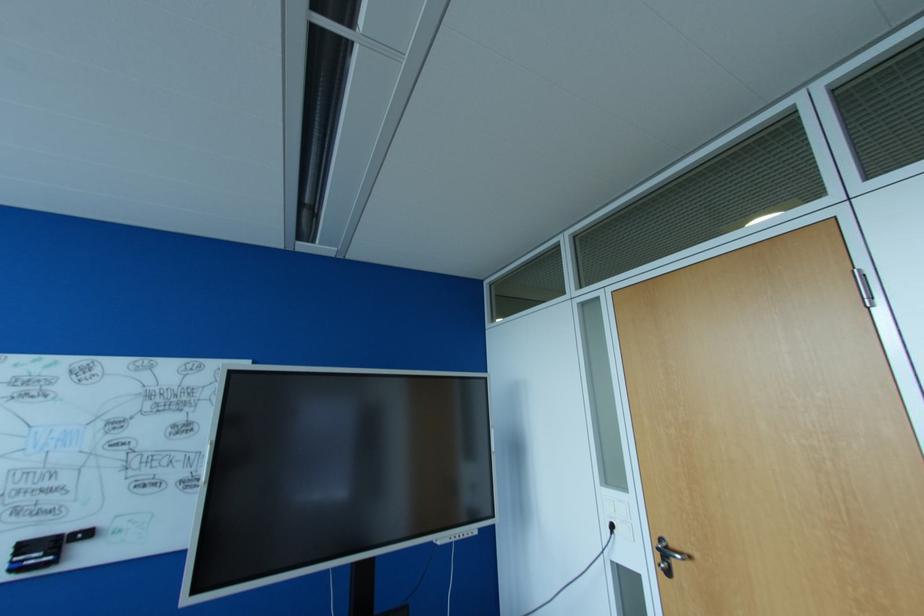
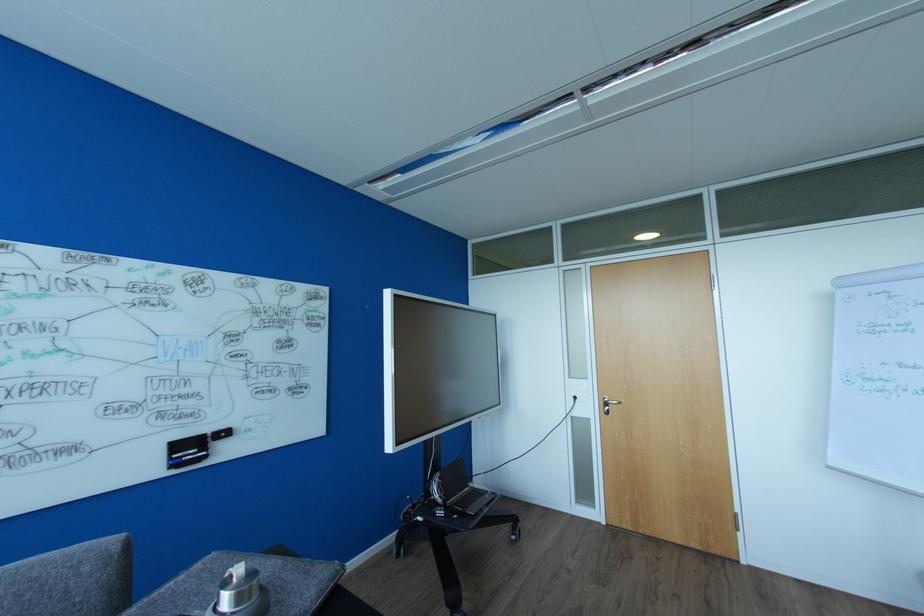
Question: In a continuous first-person perspective shot, in which direction is the camera moving?

Choices:
 (A) Left
 (B) Right
 (C) Forward
 (D) Backward

Answer: (A)